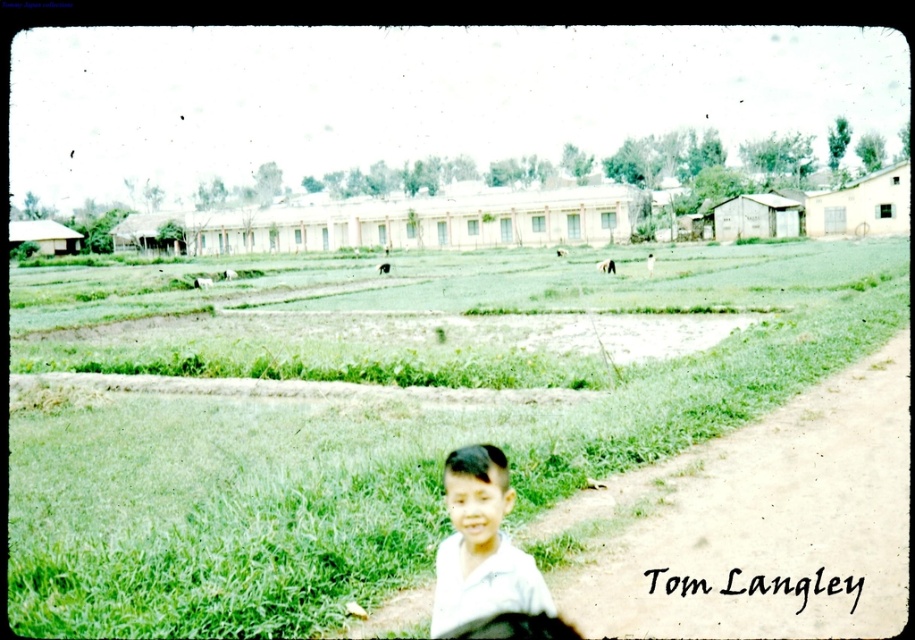
Question: Which is nearer to the light beige wood hut at right?

Choices:
 (A) brown corrugated metal hut at left
 (B) wooden hut at center-right
 (C) green grass at center

Answer: (B)

Question: Which object appears closest to the camera in this image?

Choices:
 (A) brown corrugated metal hut at left
 (B) wooden hut at left
 (C) light beige wood hut at right
 (D) white cotton shirt at lower center

Answer: (D)

Question: Which point appears closest to the camera in this image?

Choices:
 (A) (183, 234)
 (B) (447, 634)
 (C) (210, 605)
 (D) (57, 241)

Answer: (B)

Question: Does white cotton shirt at lower center lie in front of light beige wood hut at right?

Choices:
 (A) yes
 (B) no

Answer: (A)

Question: Does green grass at center have a larger size compared to white cotton shirt at lower center?

Choices:
 (A) yes
 (B) no

Answer: (A)

Question: Is white cotton shirt at lower center to the right of light beige wood hut at right from the viewer's perspective?

Choices:
 (A) yes
 (B) no

Answer: (B)